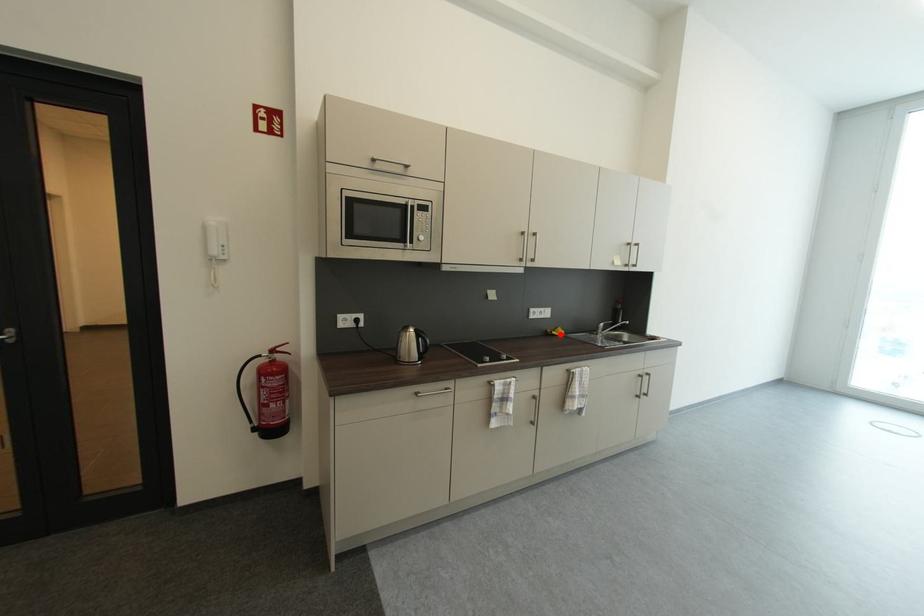
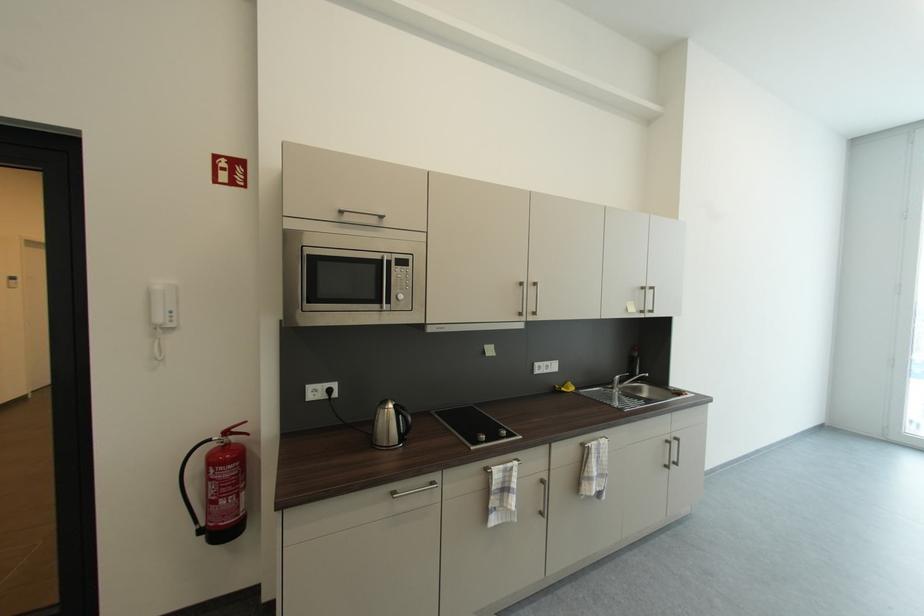
Locate, in the second image, the point that corresponds to the highlighted location in the first image.

(569, 391)